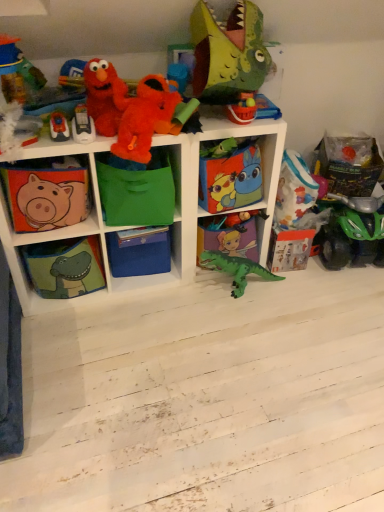
Measure the distance between point [144,224] and camera.

Point [144,224] is 5.84 feet away from camera.

What are the coordinates of `green fabric storage cubes at center, placed as the third shelf when sorted from left to right` in the screenshot? It's located at (174, 215).

Measure the distance between point (183, 75) and camera.

Point (183, 75) is 1.64 meters from camera.

Identify the location of orange plush toy at upper center, marked as the 2th toy in a top-to-bottom arrangement. The width and height of the screenshot is (384, 512). (178, 77).

Locate an element on the screen. green fabric bag at center, which ranks as the 2th shelf in right-to-left order is located at coordinates (137, 191).

From a real-world perspective, which object rests below the other?

cartoon-patterned fabric box at center, which is the 2th box from left to right, from a real-world perspective.

In order to click on the 4th toy positioned above the cartoon-patterned fabric box at center, which is the 1th box from right to left (from a real-world perspective) in this screenshot , I will do `click(104, 96)`.

Which object is wider, cartoon-patterned fabric box at center, arranged as the second box when ordered from the bottom, or fluffy plush at upper left, the 3th toy when ordered from top to bottom?

With larger width is cartoon-patterned fabric box at center, arranged as the second box when ordered from the bottom.

From a real-world perspective, which is physically below, matte fabric piggy bank at left, which ranks as the first shelf in left-to-right order, or blue cardboard box at center, the first box viewed from the left?

blue cardboard box at center, the first box viewed from the left.

Can you confirm if matte fabric piggy bank at left, the fifth shelf viewed from the right, is wider than blue cardboard box at center, which appears as the 1th box when ordered from the bottom?

Incorrect, the width of matte fabric piggy bank at left, the fifth shelf viewed from the right, does not surpass that of blue cardboard box at center, which appears as the 1th box when ordered from the bottom.

Between point (37, 222) and point (167, 269), which one is positioned behind?

Positioned behind is point (167, 269).

Is matte fabric piggy bank at left, which ranks as the first shelf in left-to-right order, placed right next to blue cardboard box at center, which appears as the 1th box when ordered from the bottom?

matte fabric piggy bank at left, which ranks as the first shelf in left-to-right order, and blue cardboard box at center, which appears as the 1th box when ordered from the bottom, are not in contact.

Between green fabric dinosaur at lower left, which appears as the 2th shelf when viewed from the left, and green fabric bag at center, which ranks as the 2th shelf in right-to-left order, which one has less height?

green fabric dinosaur at lower left, which appears as the 2th shelf when viewed from the left.

At what (x,y) coordinates should I click in order to perform the action: click on the 4th shelf below the green fabric bag at center, which ranks as the 2th shelf in right-to-left order (from the image's perspective). Please return your answer as a coordinate pair (x, y). Looking at the image, I should click on (65, 267).

Looking at this image, is green fabric dinosaur at lower left, the fourth shelf positioned from the right, turned away from green fabric bag at center, the 4th shelf when ordered from left to right?

green fabric dinosaur at lower left, the fourth shelf positioned from the right, is not turned away from green fabric bag at center, the 4th shelf when ordered from left to right.

Between point (42, 248) and point (162, 204), which one is positioned in front?

The point (162, 204) is more forward.

From the image's perspective, is plastic matte car at upper left, which is counted as the fifth toy, starting from the top, positioned above or below metallic silver toy at upper left, marked as the 6th toy in a top-to-bottom arrangement?

Clearly, from the image's perspective, plastic matte car at upper left, which is counted as the fifth toy, starting from the top, is above metallic silver toy at upper left, marked as the 6th toy in a top-to-bottom arrangement.

Is plastic matte car at upper left, the third toy when ordered from bottom to top, completely or partially outside of metallic silver toy at upper left, which ranks as the second toy in bottom-to-top order?

Yes, plastic matte car at upper left, the third toy when ordered from bottom to top, is located beyond the bounds of metallic silver toy at upper left, which ranks as the second toy in bottom-to-top order.

Between plastic matte car at upper left, the third toy when ordered from bottom to top, and metallic silver toy at upper left, which ranks as the second toy in bottom-to-top order, which one has larger size?

plastic matte car at upper left, the third toy when ordered from bottom to top, is bigger.

From the image's perspective, starting from the plastic matte car at upper left, the third toy when ordered from bottom to top, which toy is the 1st one below? Please provide its 2D coordinates.

[(59, 127)]

From a real-world perspective, does blue cardboard box at center, which appears as the 1th box when ordered from the bottom, sit lower than matte plastic bucket at upper center, positioned as the 4th toy in bottom-to-top order?

Yes.

From the image's perspective, is blue cardboard box at center, the second box positioned from the right, over matte plastic bucket at upper center, positioned as the 4th toy in bottom-to-top order?

No, from the image's perspective, blue cardboard box at center, the second box positioned from the right, is not above matte plastic bucket at upper center, positioned as the 4th toy in bottom-to-top order.

The width and height of the screenshot is (384, 512). I want to click on the 2nd box directly beneath the matte plastic bucket at upper center, positioned as the 4th toy in bottom-to-top order (from a real-world perspective), so click(139, 252).

Is blue cardboard box at center, which appears as the 1th box when ordered from the bottom, oriented towards matte plastic bucket at upper center, positioned as the 4th toy in bottom-to-top order?

No, blue cardboard box at center, which appears as the 1th box when ordered from the bottom, is not facing towards matte plastic bucket at upper center, positioned as the 4th toy in bottom-to-top order.

Considering the relative sizes of matte green dinosaur head at upper center, positioned as the 1th toy in top-to-bottom order, and fluffy plush at upper left, the 3th toy when ordered from top to bottom, in the image provided, is matte green dinosaur head at upper center, positioned as the 1th toy in top-to-bottom order, thinner than fluffy plush at upper left, the 3th toy when ordered from top to bottom,?

Incorrect, the width of matte green dinosaur head at upper center, positioned as the 1th toy in top-to-bottom order, is not less than that of fluffy plush at upper left, the 3th toy when ordered from top to bottom.

Which of these two, matte green dinosaur head at upper center, positioned as the 1th toy in top-to-bottom order, or fluffy plush at upper left, the 3th toy when ordered from top to bottom, stands taller?

matte green dinosaur head at upper center, positioned as the 1th toy in top-to-bottom order, is taller.

Looking at the image, does matte green dinosaur head at upper center, positioned as the 1th toy in top-to-bottom order, seem bigger or smaller compared to fluffy plush at upper left, the 3th toy when ordered from top to bottom?

Clearly, matte green dinosaur head at upper center, positioned as the 1th toy in top-to-bottom order, is larger in size than fluffy plush at upper left, the 3th toy when ordered from top to bottom.

Could you tell me if matte green dinosaur head at upper center, positioned as the 7th toy in bottom-to-top order, is turned towards fluffy plush at upper left, the 3th toy when ordered from top to bottom?

No, matte green dinosaur head at upper center, positioned as the 7th toy in bottom-to-top order, is not facing towards fluffy plush at upper left, the 3th toy when ordered from top to bottom.

From a real-world perspective, is green fabric bag at center, the 4th shelf when ordered from left to right, on top of plastic matte car at upper left, the third toy when ordered from bottom to top?

No, from a real-world perspective, green fabric bag at center, the 4th shelf when ordered from left to right, is not over plastic matte car at upper left, the third toy when ordered from bottom to top

Can you confirm if green fabric bag at center, the 4th shelf when ordered from left to right, is wider than plastic matte car at upper left, which is counted as the fifth toy, starting from the top?

Result: Correct, the width of green fabric bag at center, the 4th shelf when ordered from left to right, exceeds that of plastic matte car at upper left, which is counted as the fifth toy, starting from the top.

Can you confirm if green fabric bag at center, which ranks as the 2th shelf in right-to-left order, is bigger than plastic matte car at upper left, the third toy when ordered from bottom to top?

Yes, green fabric bag at center, which ranks as the 2th shelf in right-to-left order, is bigger than plastic matte car at upper left, the third toy when ordered from bottom to top.

Measure the distance from green fabric bag at center, the 4th shelf when ordered from left to right, to plastic matte car at upper left, which is counted as the fifth toy, starting from the top.

They are 10.76 inches apart.

Identify the location of the 1st box behind the fluffy plush at upper left, which ranks as the 5th toy in bottom-to-top order. The height and width of the screenshot is (512, 384). (231, 180).

Identify the location of the 2nd shelf above the blue cardboard box at center, arranged as the 2th box when viewed from the top (from the image's perspective). This screenshot has height=512, width=384. (47, 193).

From the image, which object appears to be farther from fluffy plush at upper left, which ranks as the 5th toy in bottom-to-top order, blue cardboard box at center, which appears as the 1th box when ordered from the bottom, or green matte dinosaur at center, which appears as the first shelf when viewed from the right?

green matte dinosaur at center, which appears as the first shelf when viewed from the right, lies further to fluffy plush at upper left, which ranks as the 5th toy in bottom-to-top order, than the other object.

Based on their spatial positions, is metallic silver toy at upper left, which ranks as the second toy in bottom-to-top order, or green fabric bag at center, the 4th shelf when ordered from left to right, closer to cartoon-patterned fabric box at center, arranged as the second box when ordered from the bottom?

Among the two, green fabric bag at center, the 4th shelf when ordered from left to right, is located nearer to cartoon-patterned fabric box at center, arranged as the second box when ordered from the bottom.

Considering their positions, is green fabric bag at center, which ranks as the 2th shelf in right-to-left order, positioned closer to green fabric dinosaur at lower left, the fourth shelf positioned from the right, than plastic matte car at upper left, the third toy when ordered from bottom to top?

green fabric bag at center, which ranks as the 2th shelf in right-to-left order, lies closer to green fabric dinosaur at lower left, the fourth shelf positioned from the right, than the other object.

When comparing their distances from green fabric storage cubes at center, which is counted as the 3th shelf, starting from the right, does green matte dinosaur at center, positioned as the fifth shelf in left-to-right order, or green plastic dinosaur at center, placed as the seventh toy when sorted from top to bottom, seem further?

green plastic dinosaur at center, placed as the seventh toy when sorted from top to bottom.

Estimate the real-world distances between objects in this image. Which object is closer to matte green dinosaur head at upper center, positioned as the 1th toy in top-to-bottom order, green fabric storage cubes at center, placed as the third shelf when sorted from left to right, or green plastic dinosaur at center, placed as the seventh toy when sorted from top to bottom?

green fabric storage cubes at center, placed as the third shelf when sorted from left to right, is positioned closer to the anchor matte green dinosaur head at upper center, positioned as the 1th toy in top-to-bottom order.

From the image, which object appears to be farther from cartoon-patterned fabric box at center, which is the 1th box from right to left, orange plush toy at upper center, positioned as the sixth toy in bottom-to-top order, or plastic matte car at upper left, which is counted as the fifth toy, starting from the top?

Based on the image, plastic matte car at upper left, which is counted as the fifth toy, starting from the top, appears to be further to cartoon-patterned fabric box at center, which is the 1th box from right to left.

Looking at the image, which one is located further to green fabric dinosaur at lower left, the fourth shelf positioned from the right, green plastic dinosaur at center, placed as the seventh toy when sorted from top to bottom, or metallic silver toy at upper left, marked as the 6th toy in a top-to-bottom arrangement?

green plastic dinosaur at center, placed as the seventh toy when sorted from top to bottom, lies further to green fabric dinosaur at lower left, the fourth shelf positioned from the right, than the other object.

Considering their positions, is matte fabric piggy bank at left, which ranks as the first shelf in left-to-right order, positioned further to matte plastic bucket at upper center, positioned as the 4th toy in bottom-to-top order, than matte green dinosaur head at upper center, positioned as the 7th toy in bottom-to-top order?

matte fabric piggy bank at left, which ranks as the first shelf in left-to-right order, lies further to matte plastic bucket at upper center, positioned as the 4th toy in bottom-to-top order, than the other object.

Locate an element on the screen. This screenshot has height=512, width=384. shelf situated between matte fabric piggy bank at left, the fifth shelf viewed from the right, and blue cardboard box at center, the second box positioned from the right, from left to right is located at coordinates (65, 267).

Locate an element on the screen. Image resolution: width=384 pixels, height=512 pixels. box between green fabric storage cubes at center, placed as the third shelf when sorted from left to right, and green matte dinosaur at center, positioned as the fifth shelf in left-to-right order, in the horizontal direction is located at coordinates (231, 180).

Where is `box between green fabric bag at center, which ranks as the 2th shelf in right-to-left order, and green matte dinosaur at center, which appears as the first shelf when viewed from the right`? box between green fabric bag at center, which ranks as the 2th shelf in right-to-left order, and green matte dinosaur at center, which appears as the first shelf when viewed from the right is located at coordinates (231, 180).

Image resolution: width=384 pixels, height=512 pixels. What are the coordinates of `box situated between green fabric dinosaur at lower left, the fourth shelf positioned from the right, and green fabric bag at center, the 4th shelf when ordered from left to right, from left to right` in the screenshot? It's located at (139, 252).